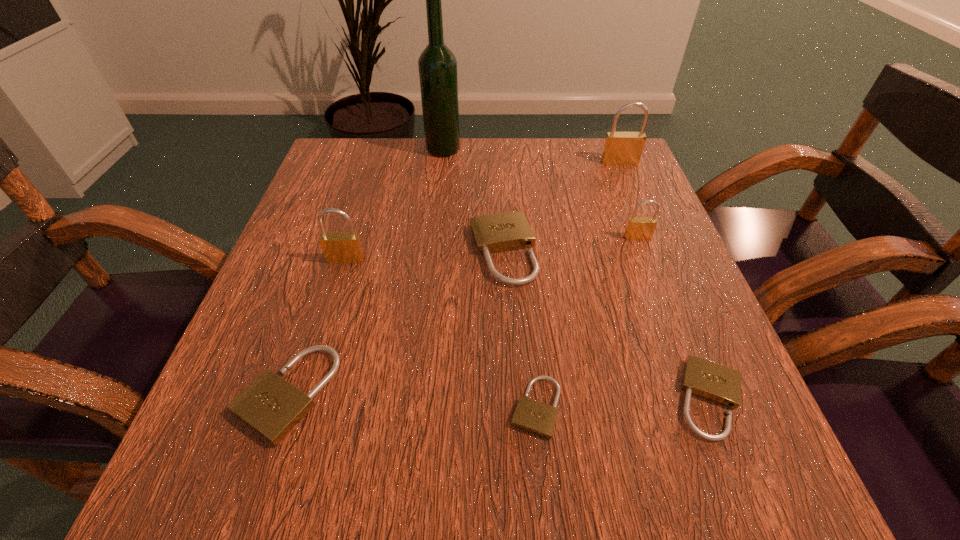
Select which beige padlock appears as the second closest to the leftmost brass padlock. Please provide its 2D coordinates. Your answer should be formatted as a tuple, i.e. [(x, y)], where the tuple contains the x and y coordinates of a point satisfying the conditions above.

[(500, 232)]

Image resolution: width=960 pixels, height=540 pixels. I want to click on beige padlock that is the third closest one to the green liquor, so click(538, 418).

Identify the location of free spot that satisfies the following two spatial constraints: 1. on the back side of the third biggest beige padlock; 2. on the right side of the shortest object. (535, 399).